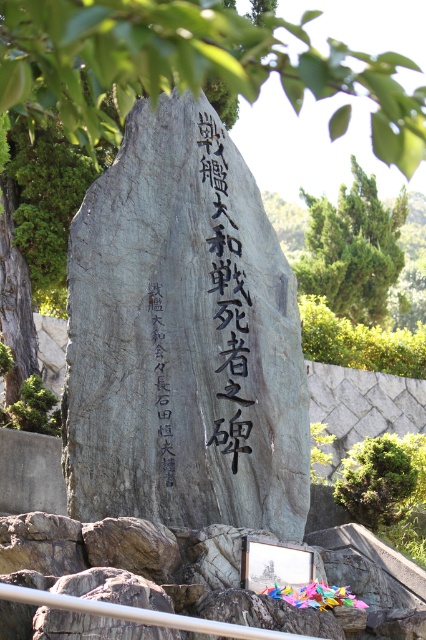
Can you confirm if gray stone monument at center is wider than metal rail at lower center?

Yes, gray stone monument at center is wider than metal rail at lower center.

Identify the location of gray stone monument at center. The width and height of the screenshot is (426, 640). (183, 337).

The width and height of the screenshot is (426, 640). I want to click on gray stone monument at center, so click(183, 337).

Is black carved stone at center closer to camera compared to metal rail at lower center?

No, black carved stone at center is behind metal rail at lower center.

Which is behind, point (224, 396) or point (235, 636)?

The point (224, 396) is more distant.

Where is `black carved stone at center`? The image size is (426, 640). black carved stone at center is located at coordinates (224, 262).

Can you confirm if green leafy tree at upper left is taller than metal rail at lower center?

Indeed, green leafy tree at upper left has a greater height compared to metal rail at lower center.

Does green leafy tree at upper left come in front of metal rail at lower center?

No, green leafy tree at upper left is further to the viewer.

Describe the element at coordinates (181, 67) in the screenshot. I see `green leafy tree at upper left` at that location.

Find the location of a particular element. This screenshot has height=640, width=426. green leafy tree at upper left is located at coordinates (181, 67).